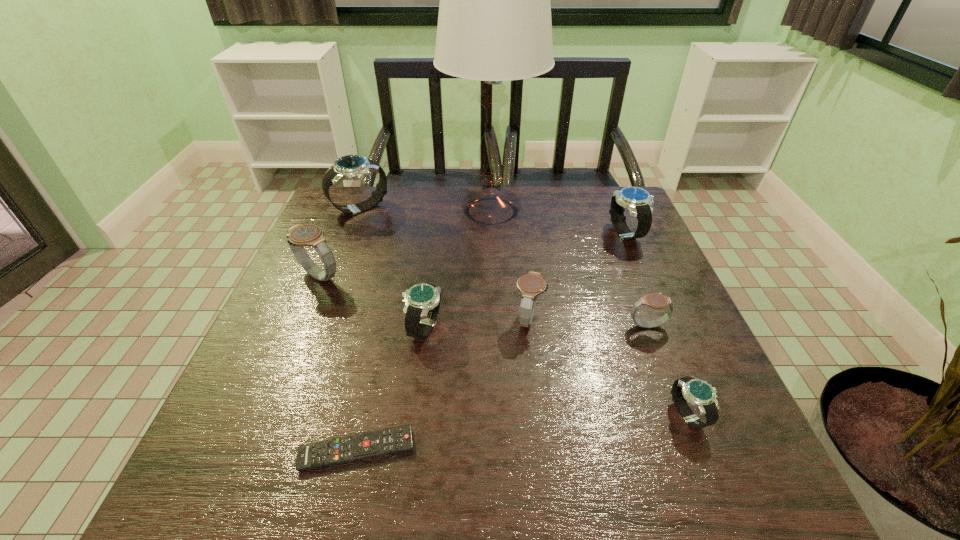
Image resolution: width=960 pixels, height=540 pixels. Identify the location of free location located on the back of the third silver watch from right to left. (432, 264).

Where is `vacant space located on the front of the smallest gray watch`? The image size is (960, 540). vacant space located on the front of the smallest gray watch is located at coordinates (716, 504).

The image size is (960, 540). In order to click on vacant region located 0.220m on the left of the smallest silver watch in this screenshot , I will do `click(551, 415)`.

Locate an element on the screen. This screenshot has height=540, width=960. free space located 0.100m on the left of the remote control is located at coordinates (241, 450).

This screenshot has width=960, height=540. Find the location of `table lamp present at the far edge`. table lamp present at the far edge is located at coordinates (494, 24).

The height and width of the screenshot is (540, 960). Find the location of `object situated at the near edge`. object situated at the near edge is located at coordinates (328, 452).

You are a GUI agent. You are given a task and a screenshot of the screen. Output one action in this format:
    pyautogui.click(x=<x>, y=<y>)
    Task: Click on the remote control positioned at the left edge
    
    Given the screenshot: What is the action you would take?
    pyautogui.click(x=328, y=452)

Where is `object that is at the far left corner`? object that is at the far left corner is located at coordinates (350, 167).

The width and height of the screenshot is (960, 540). Find the location of `object at the near left corner`. object at the near left corner is located at coordinates (328, 452).

This screenshot has width=960, height=540. I want to click on object that is at the far right corner, so click(639, 202).